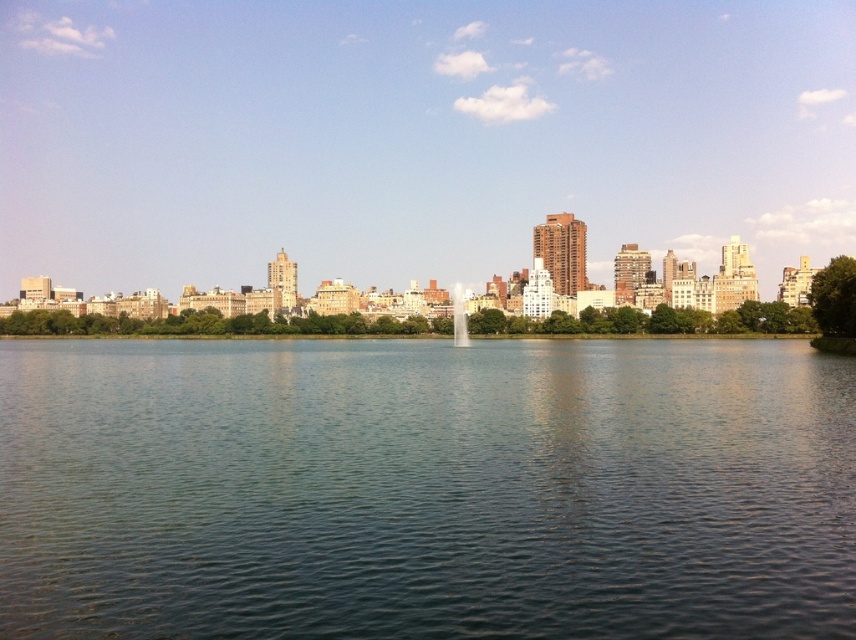
Question: Can you confirm if clear water at center is bigger than transparent glass fountain at center?

Choices:
 (A) yes
 (B) no

Answer: (A)

Question: Does clear water at center have a greater width compared to transparent glass fountain at center?

Choices:
 (A) yes
 (B) no

Answer: (A)

Question: Which of the following is the farthest from the observer?

Choices:
 (A) (649, 621)
 (B) (467, 337)

Answer: (B)

Question: Is clear water at center closer to camera compared to transparent glass fountain at center?

Choices:
 (A) no
 (B) yes

Answer: (B)

Question: Which point is farther to the camera?

Choices:
 (A) (465, 346)
 (B) (328, 477)

Answer: (A)

Question: Which object appears closest to the camera in this image?

Choices:
 (A) transparent glass fountain at center
 (B) clear water at center

Answer: (B)